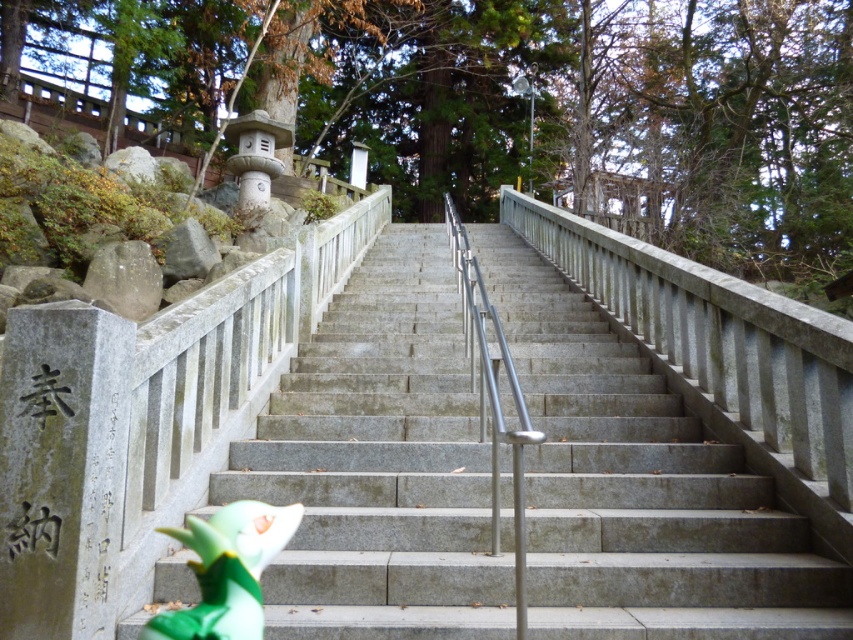
Question: Does gray stone stairs at center appear on the left side of green plastic toy at lower left?

Choices:
 (A) yes
 (B) no

Answer: (B)

Question: Considering the relative positions of gray stone stairs at center and green plastic toy at lower left in the image provided, where is gray stone stairs at center located with respect to green plastic toy at lower left?

Choices:
 (A) below
 (B) above

Answer: (B)

Question: Which object appears farthest from the camera in this image?

Choices:
 (A) green plastic toy at lower left
 (B) gray stone stairs at center

Answer: (B)

Question: Does gray stone stairs at center appear on the right side of green plastic toy at lower left?

Choices:
 (A) yes
 (B) no

Answer: (A)